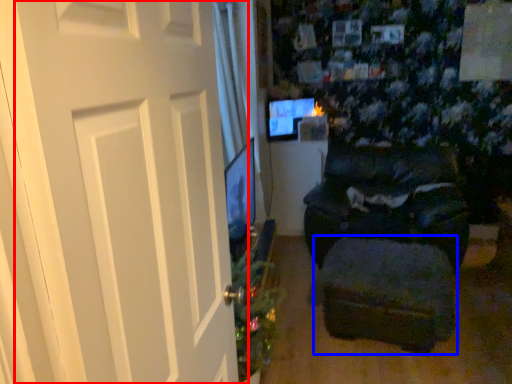
Question: Which of the following is the closest to the observer, door (highlighted by a red box) or footrest (highlighted by a blue box)?

Choices:
 (A) door
 (B) footrest

Answer: (A)